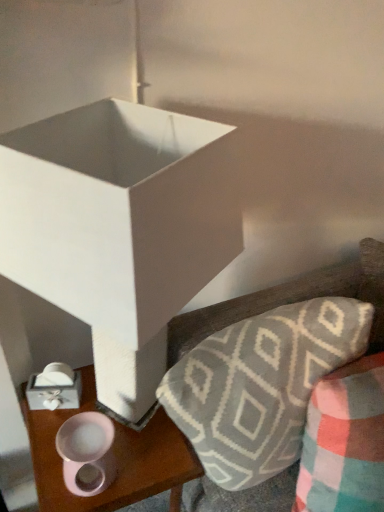
Describe the element at coordinates (115, 455) in the screenshot. The height and width of the screenshot is (512, 384). I see `pink glossy mug at lower left` at that location.

Measure the distance between point [308,455] and camera.

A distance of 33.11 inches exists between point [308,455] and camera.

Describe the element at coordinates (119, 212) in the screenshot. The image size is (384, 512). I see `white matte box at center` at that location.

Identify the location of pink matte candle holder at lower left. The width and height of the screenshot is (384, 512). (87, 453).

Is white matte box at center further to the viewer compared to plush gray and white geometric-patterned throw pillow at lower right?

No, it is not.

Considering the relative sizes of white matte box at center and plush gray and white geometric-patterned throw pillow at lower right in the image provided, is white matte box at center thinner than plush gray and white geometric-patterned throw pillow at lower right?

Indeed, white matte box at center has a lesser width compared to plush gray and white geometric-patterned throw pillow at lower right.

The image size is (384, 512). I want to click on throw pillow located underneath the white matte box at center (from a real-world perspective), so pos(345,441).

Measure the distance from pink matte candle holder at lower left to textured gray pillow at upper right.

pink matte candle holder at lower left and textured gray pillow at upper right are 16.34 inches apart.

Considering the sizes of pink matte candle holder at lower left and textured gray pillow at upper right in the image, is pink matte candle holder at lower left wider or thinner than textured gray pillow at upper right?

In the image, pink matte candle holder at lower left appears to be more narrow than textured gray pillow at upper right.

Based on the photo, is pink matte candle holder at lower left next to textured gray pillow at upper right?

No, pink matte candle holder at lower left is not beside textured gray pillow at upper right.

Can you confirm if pink matte candle holder at lower left is shorter than textured gray pillow at upper right?

Yes, pink matte candle holder at lower left is shorter than textured gray pillow at upper right.

What's the angular difference between textured gray pillow at upper right and plush gray and white geometric-patterned throw pillow at lower right's facing directions?

The facing directions of textured gray pillow at upper right and plush gray and white geometric-patterned throw pillow at lower right are 1.62 degrees apart.

In the scene shown: Is textured gray pillow at upper right turned away from plush gray and white geometric-patterned throw pillow at lower right?

textured gray pillow at upper right does not have its back to plush gray and white geometric-patterned throw pillow at lower right.

Based on the photo, considering the positions of objects textured gray pillow at upper right and plush gray and white geometric-patterned throw pillow at lower right in the image provided, who is in front, textured gray pillow at upper right or plush gray and white geometric-patterned throw pillow at lower right?

plush gray and white geometric-patterned throw pillow at lower right is in front.

Does textured gray pillow at upper right have a lesser width compared to plush gray and white geometric-patterned throw pillow at lower right?

No, textured gray pillow at upper right is not thinner than plush gray and white geometric-patterned throw pillow at lower right.

How distant is pink glossy mug at lower left from white matte box at center?

A distance of 49.52 centimeters exists between pink glossy mug at lower left and white matte box at center.

Is pink glossy mug at lower left shorter than white matte box at center?

Correct, pink glossy mug at lower left is not as tall as white matte box at center.

Considering the positions of objects pink glossy mug at lower left and white matte box at center in the image provided, who is more to the right, pink glossy mug at lower left or white matte box at center?

Positioned to the right is white matte box at center.

From a real-world perspective, is white matte box at center beneath textured gray pillow at upper right?

Incorrect, from a real-world perspective, white matte box at center is higher than textured gray pillow at upper right.

Which is correct: white matte box at center is inside textured gray pillow at upper right, or outside of it?

The correct answer is: outside.

Is white matte box at center wider or thinner than textured gray pillow at upper right?

white matte box at center is thinner than textured gray pillow at upper right.

Which of these two, white matte box at center or textured gray pillow at upper right, stands shorter?

textured gray pillow at upper right is shorter.

In terms of width, does pink matte candle holder at lower left look wider or thinner when compared to white matte box at center?

Clearly, pink matte candle holder at lower left has less width compared to white matte box at center.

From the image's perspective, is pink matte candle holder at lower left positioned above or below white matte box at center?

From the image's perspective, pink matte candle holder at lower left appears below white matte box at center.

Which is in front, pink matte candle holder at lower left or white matte box at center?

white matte box at center is closer to the camera.

Is pink matte candle holder at lower left spatially inside white matte box at center, or outside of it?

The correct answer is: inside.

From the image's perspective, is pink matte candle holder at lower left over plush gray and white geometric-patterned throw pillow at lower right?

No, from the image's perspective, pink matte candle holder at lower left is not over plush gray and white geometric-patterned throw pillow at lower right.

What are the coordinates of `throw pillow lying in front of the pink matte candle holder at lower left` in the screenshot? It's located at (345, 441).

Measure the distance from pink matte candle holder at lower left to plush gray and white geometric-patterned throw pillow at lower right.

pink matte candle holder at lower left and plush gray and white geometric-patterned throw pillow at lower right are 17.52 inches apart.

Which point is more forward, (103, 445) or (346, 461)?

The point (346, 461) is in front.

The height and width of the screenshot is (512, 384). I want to click on box in front of the plush gray and white geometric-patterned throw pillow at lower right, so click(x=119, y=212).

Where is `candle holder behind the textured gray pillow at upper right`? The height and width of the screenshot is (512, 384). candle holder behind the textured gray pillow at upper right is located at coordinates (87, 453).

Looking at the image, which one is located further to pink glossy mug at lower left, white matte box at center or textured gray pillow at upper right?

Among the two, white matte box at center is located further to pink glossy mug at lower left.

From the picture: Looking at the image, which one is located further to textured gray pillow at upper right, plush gray and white geometric-patterned throw pillow at lower right or pink matte candle holder at lower left?

pink matte candle holder at lower left lies further to textured gray pillow at upper right than the other object.

Looking at this image, which object lies nearer to the anchor point plush gray and white geometric-patterned throw pillow at lower right, white matte box at center or textured gray pillow at upper right?

The object closer to plush gray and white geometric-patterned throw pillow at lower right is textured gray pillow at upper right.

Estimate the real-world distances between objects in this image. Which object is further from plush gray and white geometric-patterned throw pillow at lower right, white matte box at center or pink glossy mug at lower left?

The object further to plush gray and white geometric-patterned throw pillow at lower right is white matte box at center.

From the picture: From the image, which object appears to be farther from pink matte candle holder at lower left, plush gray and white geometric-patterned throw pillow at lower right or textured gray pillow at upper right?

plush gray and white geometric-patterned throw pillow at lower right is further to pink matte candle holder at lower left.

Looking at the image, which one is located further to plush gray and white geometric-patterned throw pillow at lower right, textured gray pillow at upper right or pink matte candle holder at lower left?

pink matte candle holder at lower left is positioned further to the anchor plush gray and white geometric-patterned throw pillow at lower right.

Considering their positions, is white matte box at center positioned closer to pink glossy mug at lower left than pink matte candle holder at lower left?

pink matte candle holder at lower left is closer to pink glossy mug at lower left.

From the image, which object appears to be nearer to pink glossy mug at lower left, textured gray pillow at upper right or white matte box at center?

textured gray pillow at upper right is closer to pink glossy mug at lower left.

At what (x,y) coordinates should I click in order to perform the action: click on box between pink matte candle holder at lower left and textured gray pillow at upper right in the horizontal direction. Please return your answer as a coordinate pair (x, y). Looking at the image, I should click on (119, 212).

Where is `furniture between white matte box at center and pink glossy mug at lower left in the up-down direction`? furniture between white matte box at center and pink glossy mug at lower left in the up-down direction is located at coordinates (291, 300).

Identify the location of candle holder located between pink glossy mug at lower left and textured gray pillow at upper right in the left-right direction. The image size is (384, 512). (87, 453).

This screenshot has height=512, width=384. Find the location of `furniture between pink matte candle holder at lower left and plush gray and white geometric-patterned throw pillow at lower right from left to right`. furniture between pink matte candle holder at lower left and plush gray and white geometric-patterned throw pillow at lower right from left to right is located at coordinates (291, 300).